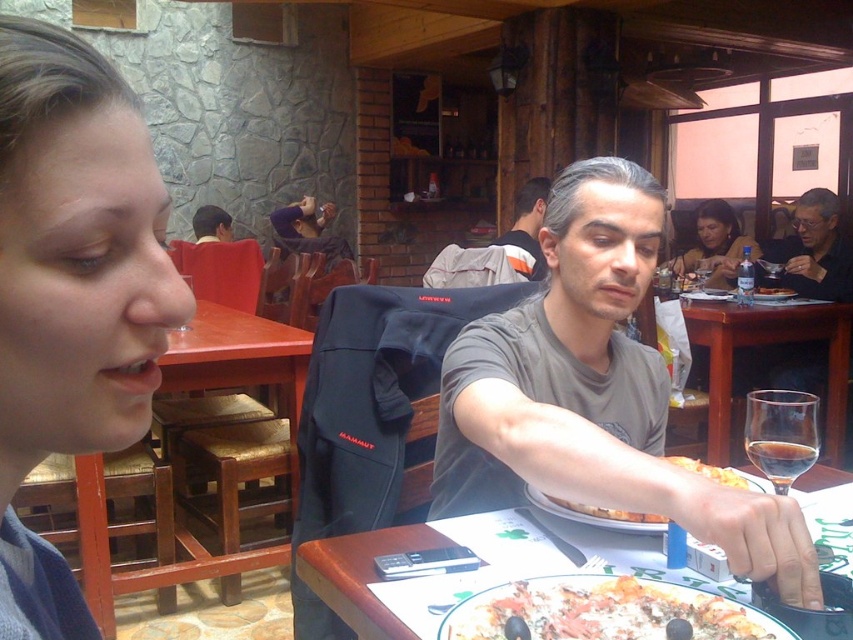
You are a photographer standing at the entrance of the restaurant. You want to take a photo of the gray cotton shirt at center. Where should you position your camera to capture the shirt in the frame?

The gray cotton shirt at center is located at point 0.389 on the x axis and 0.585 on the y axis, so you should position your camera to focus on those coordinates to capture the shirt in the frame.

You are a waiter in a rustic restaurant. You need to place a new menu on the table. The menu is 3 cm thick. There is a blue fabric at left and a transparent glass at center on the table. Which object can the menu be placed under without bending?

The blue fabric at left is thinner than the transparent glass at center, so the menu can be placed under the blue fabric at left without bending since it is thinner.

You are a photographer taking a picture of the gray cotton shirt at center and the transparent glass at right. Which object should you focus on first if you want to capture both in sharp focus?

The gray cotton shirt at center is much taller than the transparent glass at right, so you should focus on the gray cotton shirt at center first to ensure both are in sharp focus.